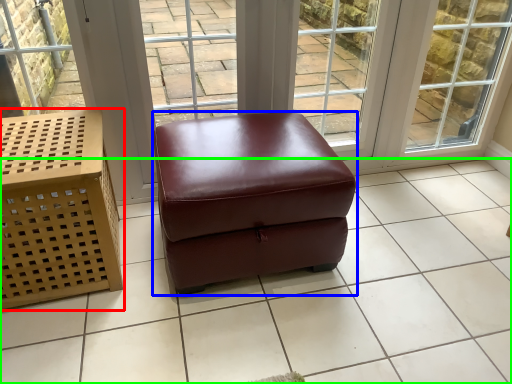
Question: Which object is positioned closest to furniture (highlighted by a red box)? Select from stool (highlighted by a blue box) and tile (highlighted by a green box).

Choices:
 (A) stool
 (B) tile

Answer: (A)